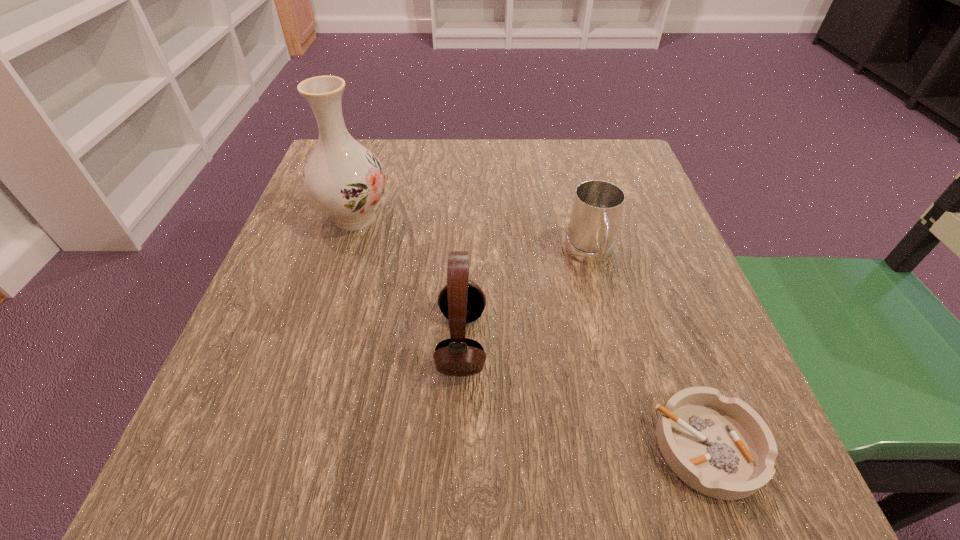
In the image, there is a desktop. Where is `vacant space at the far right corner`? The height and width of the screenshot is (540, 960). vacant space at the far right corner is located at coordinates (629, 146).

Where is `vacant area that lies between the nearest object and the leftmost object`? The width and height of the screenshot is (960, 540). vacant area that lies between the nearest object and the leftmost object is located at coordinates (532, 332).

This screenshot has width=960, height=540. What are the coordinates of `free spot between the ashtray and the headset` in the screenshot? It's located at (585, 394).

The width and height of the screenshot is (960, 540). In order to click on vacant space that's between the tallest object and the nearest object in this screenshot , I will do `click(532, 332)`.

At what (x,y) coordinates should I click in order to perform the action: click on empty space between the second shortest object and the vase. Please return your answer as a coordinate pair (x, y). The image size is (960, 540). Looking at the image, I should click on (472, 236).

You are a GUI agent. You are given a task and a screenshot of the screen. Output one action in this format:
    pyautogui.click(x=<x>, y=<y>)
    Task: Click on the vacant area that lies between the nearest object and the third tallest object
    The height and width of the screenshot is (540, 960).
    Given the screenshot: What is the action you would take?
    pyautogui.click(x=649, y=350)

Where is `unoccupied position between the second tallest object and the leftmost object`? Image resolution: width=960 pixels, height=540 pixels. unoccupied position between the second tallest object and the leftmost object is located at coordinates (408, 280).

At what (x,y) coordinates should I click in order to perform the action: click on vacant space that is in between the mug and the second tallest object. Please return your answer as a coordinate pair (x, y). The image size is (960, 540). Looking at the image, I should click on (526, 299).

Identify the location of vacant space that's between the headset and the ashtray. Image resolution: width=960 pixels, height=540 pixels. (585, 394).

Locate an element on the screen. Image resolution: width=960 pixels, height=540 pixels. free space that is in between the third farthest object and the nearest object is located at coordinates (585, 394).